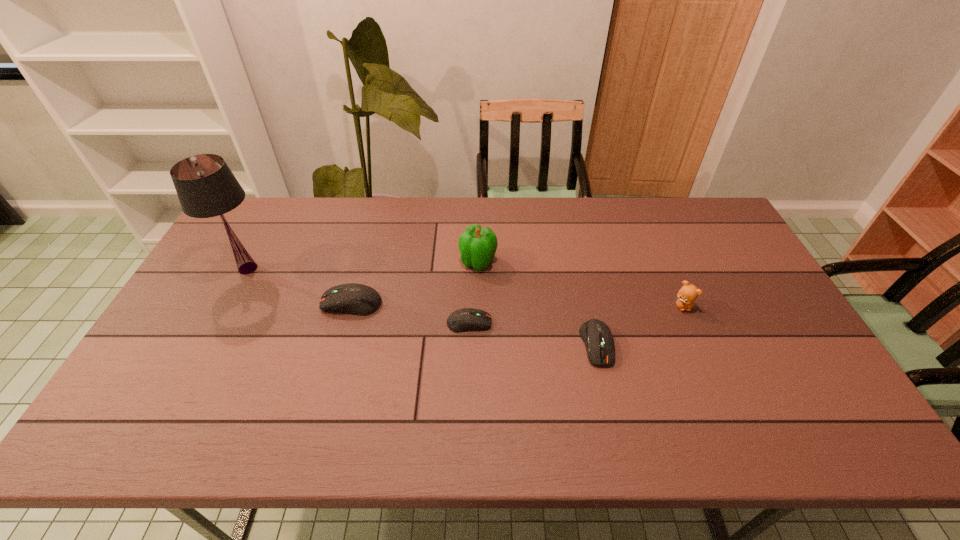
Locate an element on the screen. This screenshot has height=540, width=960. vacant space located on the button of the leftmost computer equipment is located at coordinates (202, 303).

This screenshot has height=540, width=960. In order to click on free region located on the button of the leftmost computer equipment in this screenshot , I will do `click(194, 303)`.

Find the location of a particular element. The image size is (960, 540). vacant space situated on the button of the leftmost computer equipment is located at coordinates (211, 303).

What are the coordinates of `free space located on the button of the shortest computer equipment` in the screenshot? It's located at (632, 323).

Where is `vacant region located on the front of the bell pepper`? The image size is (960, 540). vacant region located on the front of the bell pepper is located at coordinates (478, 334).

The width and height of the screenshot is (960, 540). I want to click on vacant space located on the front-facing side of the lampshade, so click(x=206, y=346).

Where is `vacant space situated on the face of the rightmost object`? The width and height of the screenshot is (960, 540). vacant space situated on the face of the rightmost object is located at coordinates (714, 381).

The image size is (960, 540). Identify the location of object present at the left edge. (206, 187).

Where is `blank space at the far edge`? This screenshot has width=960, height=540. blank space at the far edge is located at coordinates (316, 238).

Find the location of a particular element. This screenshot has height=540, width=960. free space at the near edge is located at coordinates (462, 382).